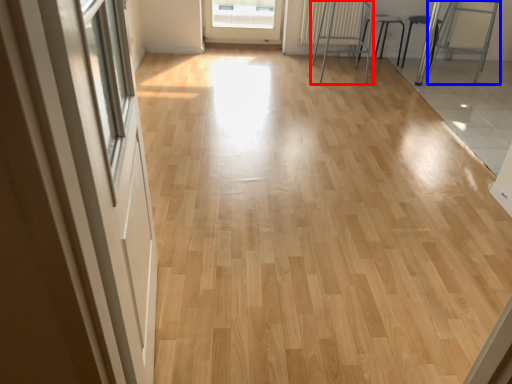
Question: Which point is closer to the camera, furniture (highlighted by a red box) or armchair (highlighted by a blue box)?

Choices:
 (A) furniture
 (B) armchair

Answer: (A)